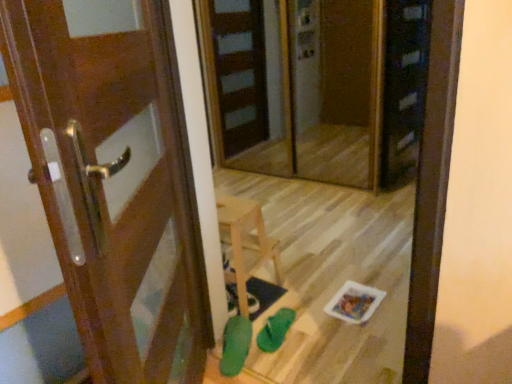
The image size is (512, 384). I want to click on green rubber shoe at lower center, the 2th shoe in the left-to-right sequence, so click(275, 330).

Describe the element at coordinates (114, 180) in the screenshot. The image size is (512, 384). I see `wooden door at left` at that location.

You are a GUI agent. You are given a task and a screenshot of the screen. Output one action in this format:
    pyautogui.click(x=<x>, y=<y>)
    Task: Click on the wooden door at left
    Image resolution: width=512 pixels, height=384 pixels.
    Given the screenshot: What is the action you would take?
    pyautogui.click(x=114, y=180)

Find the location of `green rubber shoe at lower center, arranged as the first shoe when viewed from the left`. green rubber shoe at lower center, arranged as the first shoe when viewed from the left is located at coordinates (234, 345).

From a real-world perspective, is wooden door at left beneath transparent glass screen door at center?

Yes.

From the image's perspective, which is below, wooden door at left or transparent glass screen door at center?

wooden door at left is shown below in the image.

Is wooden door at left next to transparent glass screen door at center?

No, wooden door at left is not touching transparent glass screen door at center.

Does green rubber shoe at lower center, arranged as the first shoe when viewed from the left, turn towards green rubber shoe at lower center, which is the 1th shoe from right to left?

No, green rubber shoe at lower center, arranged as the first shoe when viewed from the left, is not turned towards green rubber shoe at lower center, which is the 1th shoe from right to left.

In the image, is green rubber shoe at lower center, which is the second shoe in right-to-left order, positioned in front of or behind green rubber shoe at lower center, which is the 1th shoe from right to left?

green rubber shoe at lower center, which is the second shoe in right-to-left order, is positioned closer to the viewer than green rubber shoe at lower center, which is the 1th shoe from right to left.

Between green rubber shoe at lower center, arranged as the first shoe when viewed from the left, and green rubber shoe at lower center, which is the 1th shoe from right to left, which one has smaller size?

green rubber shoe at lower center, which is the 1th shoe from right to left.

Which is in front, point (247, 354) or point (266, 345)?

Positioned in front is point (247, 354).

Is green rubber shoe at lower center, which is the 1th shoe from right to left, inside or outside of transparent glass screen door at center?

green rubber shoe at lower center, which is the 1th shoe from right to left, exists outside the volume of transparent glass screen door at center.

Is green rubber shoe at lower center, which is the 1th shoe from right to left, next to transparent glass screen door at center?

No, green rubber shoe at lower center, which is the 1th shoe from right to left, is not touching transparent glass screen door at center.

Considering the sizes of objects green rubber shoe at lower center, the 2th shoe in the left-to-right sequence, and transparent glass screen door at center in the image provided, who is wider, green rubber shoe at lower center, the 2th shoe in the left-to-right sequence, or transparent glass screen door at center?

With larger width is green rubber shoe at lower center, the 2th shoe in the left-to-right sequence.

From a real-world perspective, which object rests below the other?

green rubber shoe at lower center, which is the 1th shoe from right to left, from a real-world perspective.

Consider the image. Is green rubber shoe at lower center, which is the 1th shoe from right to left, oriented away from green rubber shoe at lower center, arranged as the first shoe when viewed from the left?

Correct, green rubber shoe at lower center, which is the 1th shoe from right to left, is looking away from green rubber shoe at lower center, arranged as the first shoe when viewed from the left.

Can you confirm if green rubber shoe at lower center, which is the 1th shoe from right to left, is taller than green rubber shoe at lower center, which is the second shoe in right-to-left order?

No.

Is green rubber shoe at lower center, which is the 1th shoe from right to left, not within green rubber shoe at lower center, arranged as the first shoe when viewed from the left?

Yes, green rubber shoe at lower center, which is the 1th shoe from right to left, is outside of green rubber shoe at lower center, arranged as the first shoe when viewed from the left.

Does green rubber shoe at lower center, which is the 1th shoe from right to left, appear on the right side of green rubber shoe at lower center, which is the second shoe in right-to-left order?

Correct, you'll find green rubber shoe at lower center, which is the 1th shoe from right to left, to the right of green rubber shoe at lower center, which is the second shoe in right-to-left order.

Is wooden door at left outside of green rubber shoe at lower center, the 2th shoe in the left-to-right sequence?

That's correct, wooden door at left is outside of green rubber shoe at lower center, the 2th shoe in the left-to-right sequence.

How different are the orientations of wooden door at left and green rubber shoe at lower center, the 2th shoe in the left-to-right sequence, in degrees?

They differ by 65 degrees in their facing directions.

Where is `door on the left side of green rubber shoe at lower center, which is the 1th shoe from right to left`? Image resolution: width=512 pixels, height=384 pixels. door on the left side of green rubber shoe at lower center, which is the 1th shoe from right to left is located at coordinates (114, 180).

Can you confirm if wooden door at left is taller than green rubber shoe at lower center, which is the 1th shoe from right to left?

Correct, wooden door at left is much taller as green rubber shoe at lower center, which is the 1th shoe from right to left.

Is transparent glass screen door at center to the right of wooden door at left from the viewer's perspective?

Yes, transparent glass screen door at center is to the right of wooden door at left.

Is transparent glass screen door at center facing towards wooden door at left?

Yes, transparent glass screen door at center is aimed at wooden door at left.

Which object is wider, transparent glass screen door at center or wooden door at left?

Wider between the two is wooden door at left.

From the image's perspective, is transparent glass screen door at center on wooden door at left?

Yes.

Is green rubber shoe at lower center, arranged as the first shoe when viewed from the left, far from wooden door at left?

No.

Would you say wooden door at left is part of green rubber shoe at lower center, arranged as the first shoe when viewed from the left,'s contents?

That's incorrect, wooden door at left is not inside green rubber shoe at lower center, arranged as the first shoe when viewed from the left.

Does point (225, 374) come farther from viewer compared to point (39, 65)?

Yes.

From a real-world perspective, is green rubber shoe at lower center, which is the second shoe in right-to-left order, physically located above or below wooden door at left?

Clearly, from a real-world perspective, green rubber shoe at lower center, which is the second shoe in right-to-left order, is below wooden door at left.

The image size is (512, 384). Find the location of `screen door lying behind the wooden door at left`. screen door lying behind the wooden door at left is located at coordinates (295, 86).

Where is `shoe above the green rubber shoe at lower center, arranged as the first shoe when viewed from the left (from the image's perspective)`? The image size is (512, 384). shoe above the green rubber shoe at lower center, arranged as the first shoe when viewed from the left (from the image's perspective) is located at coordinates (275, 330).

Based on their spatial positions, is green rubber shoe at lower center, which is the second shoe in right-to-left order, or green rubber shoe at lower center, the 2th shoe in the left-to-right sequence, further from wooden door at left?

Based on the image, green rubber shoe at lower center, the 2th shoe in the left-to-right sequence, appears to be further to wooden door at left.

Looking at the image, which one is located closer to wooden door at left, transparent glass screen door at center or green rubber shoe at lower center, which is the 1th shoe from right to left?

green rubber shoe at lower center, which is the 1th shoe from right to left.

Estimate the real-world distances between objects in this image. Which object is further from green rubber shoe at lower center, which is the second shoe in right-to-left order, wooden door at left or green rubber shoe at lower center, which is the 1th shoe from right to left?

wooden door at left is further to green rubber shoe at lower center, which is the second shoe in right-to-left order.

Based on their spatial positions, is transparent glass screen door at center or green rubber shoe at lower center, arranged as the first shoe when viewed from the left, closer to wooden door at left?

The object closer to wooden door at left is green rubber shoe at lower center, arranged as the first shoe when viewed from the left.

Estimate the real-world distances between objects in this image. Which object is closer to transparent glass screen door at center, wooden door at left or green rubber shoe at lower center, the 2th shoe in the left-to-right sequence?

wooden door at left.

Considering their positions, is transparent glass screen door at center positioned closer to green rubber shoe at lower center, which is the 1th shoe from right to left, than green rubber shoe at lower center, arranged as the first shoe when viewed from the left?

green rubber shoe at lower center, arranged as the first shoe when viewed from the left, is closer to green rubber shoe at lower center, which is the 1th shoe from right to left.

Looking at this image, which object lies further to the anchor point wooden door at left, green rubber shoe at lower center, the 2th shoe in the left-to-right sequence, or green rubber shoe at lower center, arranged as the first shoe when viewed from the left?

Among the two, green rubber shoe at lower center, the 2th shoe in the left-to-right sequence, is located further to wooden door at left.

Based on their spatial positions, is green rubber shoe at lower center, the 2th shoe in the left-to-right sequence, or transparent glass screen door at center further from green rubber shoe at lower center, which is the second shoe in right-to-left order?

Among the two, transparent glass screen door at center is located further to green rubber shoe at lower center, which is the second shoe in right-to-left order.

Identify the location of shoe located between wooden door at left and green rubber shoe at lower center, which is the 1th shoe from right to left, in the depth direction. (234, 345).

The image size is (512, 384). Identify the location of shoe between transparent glass screen door at center and green rubber shoe at lower center, which is the second shoe in right-to-left order, in the vertical direction. (275, 330).